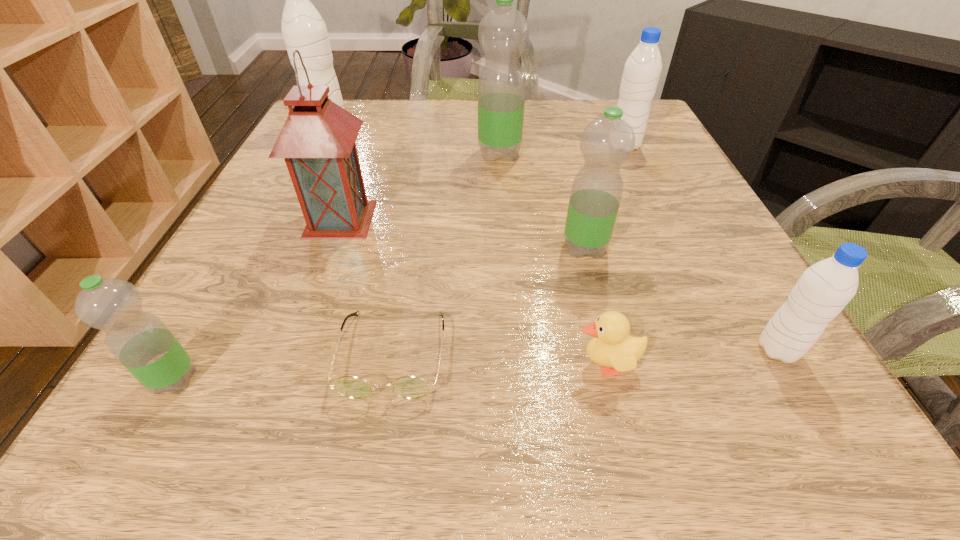
Find the location of a particular element. The height and width of the screenshot is (540, 960). free space at the near right corner is located at coordinates (789, 395).

Identify the location of vacant area that lies between the smallest gray water bottle and the leftmost gray water bottle. This screenshot has width=960, height=540. (553, 238).

You are a GUI agent. You are given a task and a screenshot of the screen. Output one action in this format:
    pyautogui.click(x=<x>, y=<y>)
    Task: Click on the unoccupied position between the spectacles and the fifth object from left to right
    
    Given the screenshot: What is the action you would take?
    pyautogui.click(x=446, y=253)

Locate an element on the screen. The width and height of the screenshot is (960, 540). free space between the second shortest object and the third water bottle from right to left is located at coordinates (595, 306).

The width and height of the screenshot is (960, 540). I want to click on vacant area that lies between the leftmost green water bottle and the second gray water bottle from right to left, so click(x=399, y=263).

At what (x,y) coordinates should I click in order to perform the action: click on vacant point located between the second shortest object and the rightmost gray water bottle. Please return your answer as a coordinate pair (x, y). Image resolution: width=960 pixels, height=540 pixels. Looking at the image, I should click on (692, 357).

This screenshot has width=960, height=540. What are the coordinates of `free space between the fifth water bottle from left to right and the leftmost green water bottle` in the screenshot? It's located at (399, 263).

Image resolution: width=960 pixels, height=540 pixels. What are the coordinates of `vacant point located between the spectacles and the leftmost gray water bottle` in the screenshot? It's located at (361, 240).

At what (x,y) coordinates should I click in order to perform the action: click on vacant space in between the leftmost green water bottle and the fourth object from left to right. Please return your answer as a coordinate pair (x, y). The height and width of the screenshot is (540, 960). Looking at the image, I should click on (283, 366).

Image resolution: width=960 pixels, height=540 pixels. Identify the location of object that stands as the fifth closest to the third water bottle from right to left. (642, 70).